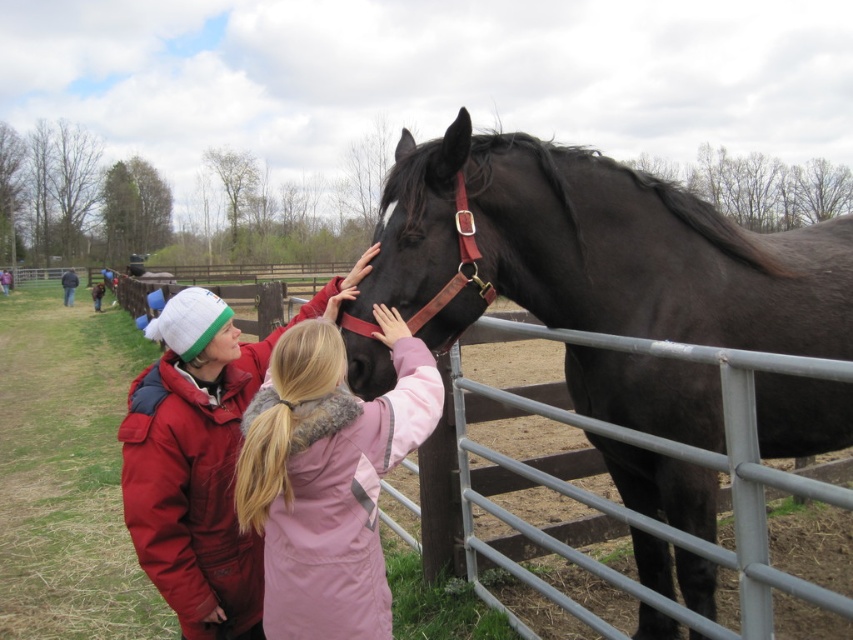
Question: Which object appears farthest from the camera in this image?

Choices:
 (A) black leather horse at center
 (B) dark blue jacket at left

Answer: (B)

Question: Is the position of black leather horse at center more distant than that of dark blue jacket at left?

Choices:
 (A) no
 (B) yes

Answer: (A)

Question: Can you confirm if black leather horse at center is thinner than dark blue jacket at left?

Choices:
 (A) yes
 (B) no

Answer: (A)

Question: Based on their relative distances, which object is farther from the pink fuzzy coat at center?

Choices:
 (A) dark blue jacket at left
 (B) black leather horse at center

Answer: (A)

Question: Can you confirm if pink fuzzy coat at center is bigger than dark blue jacket at left?

Choices:
 (A) yes
 (B) no

Answer: (B)

Question: Which of the following is the farthest from the observer?

Choices:
 (A) (65, 300)
 (B) (637, 493)
 (C) (403, 381)

Answer: (A)